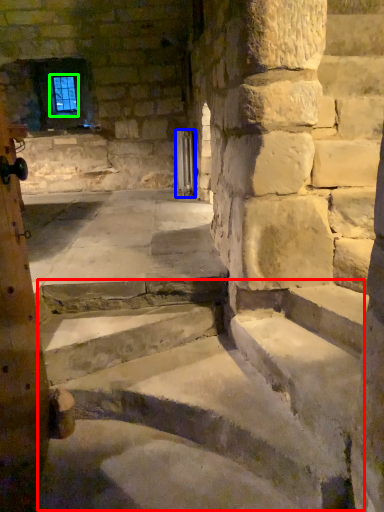
Question: Based on their relative distances, which object is farther from stairwell (highlighted by a red box)? Choose from door (highlighted by a blue box) and window screen (highlighted by a green box).

Choices:
 (A) door
 (B) window screen

Answer: (B)